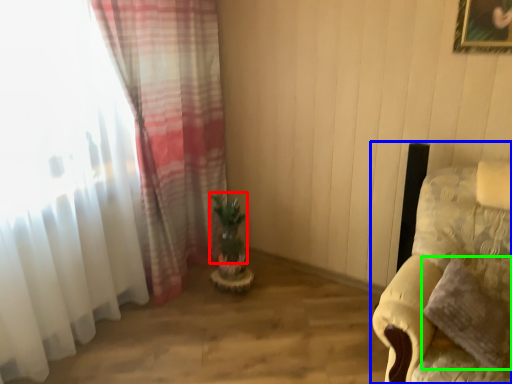
Question: Which object is positioned closest to plant (highlighted by a red box)? Select from furniture (highlighted by a blue box) and pillow (highlighted by a green box).

Choices:
 (A) furniture
 (B) pillow

Answer: (A)